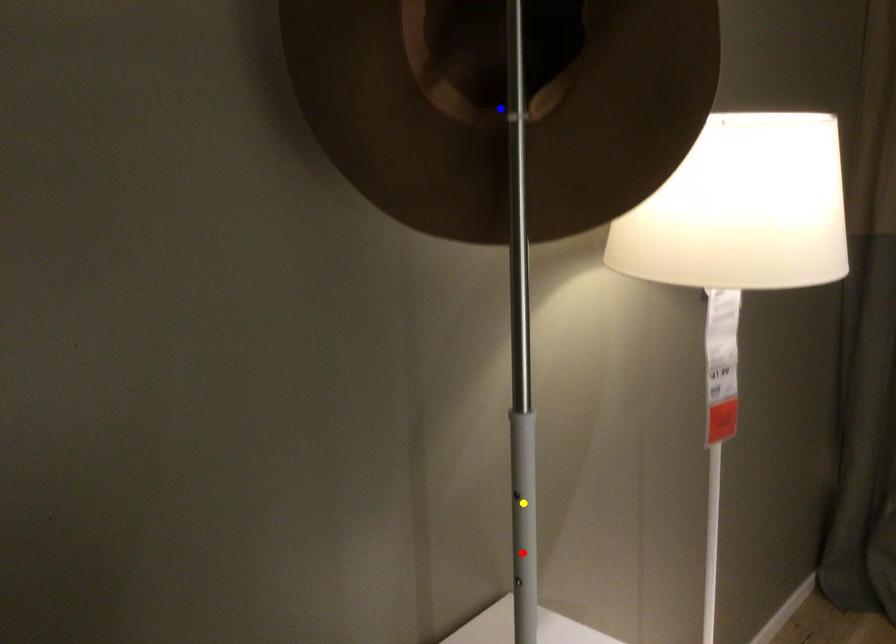
Order these from nearest to farthest:
blue point
red point
yellow point

blue point < yellow point < red point